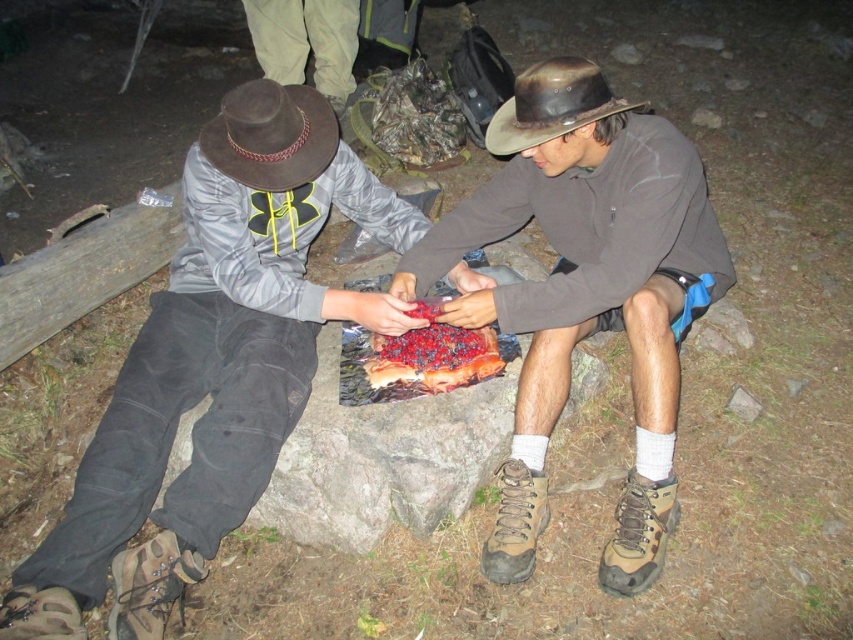
Is matte gray jacket at center bigger than tan suede hiking boot at lower right?

Yes, matte gray jacket at center is bigger than tan suede hiking boot at lower right.

The image size is (853, 640). Find the location of `matte gray jacket at center`. matte gray jacket at center is located at coordinates (218, 346).

What do you see at coordinates (218, 346) in the screenshot? I see `matte gray jacket at center` at bounding box center [218, 346].

At what (x,y) coordinates should I click in order to perform the action: click on matte gray jacket at center. Please return your answer as a coordinate pair (x, y). The image size is (853, 640). Looking at the image, I should click on (218, 346).

Does matte gray jacket at center lie behind red berry-topped bread at center?

No, matte gray jacket at center is in front of red berry-topped bread at center.

Which is behind, point (399, 310) or point (494, 365)?

Point (494, 365)

Where is `matte gray jacket at center`? matte gray jacket at center is located at coordinates (218, 346).

Is point (247, 125) closer to viewer compared to point (480, 340)?

Yes.

Who is positioned more to the right, brown suede cowboy hat at upper left or red berry-topped bread at center?

red berry-topped bread at center

Locate an element on the screen. Image resolution: width=853 pixels, height=640 pixels. brown suede cowboy hat at upper left is located at coordinates (271, 134).